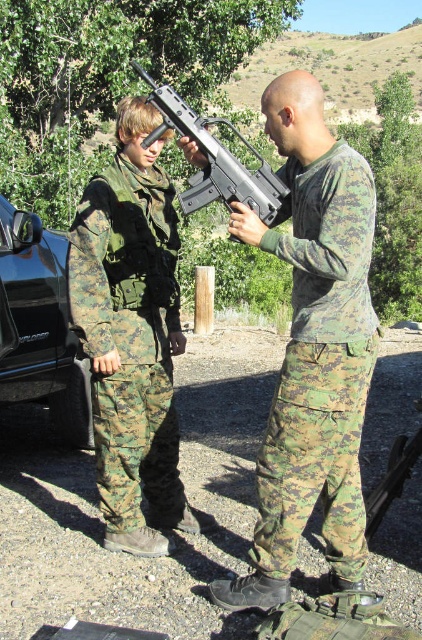
You are a photographer positioned at the center of the scene. You need to capture a photo that includes both the camouflage fabric pants at center and the metallic gray rifle at center. Based on their positions, which object should you pan your camera to the left to include first?

The metallic gray rifle at center should be panned to the left first because the camouflage fabric pants at center is to the right of it, so panning left would first bring the rifle into frame before the pants.

You are a photographer setting up a shot of the camouflage fabric uniform at left and the black glossy car at left. The minimum distance your camera can focus on two objects is 1.5 meters. Will both objects be in focus?

The camouflage fabric uniform at left and black glossy car at left are 1.27 meters apart, which is less than the camera minimum focusing distance of 1.5 meters. Therefore, both objects will be in focus.